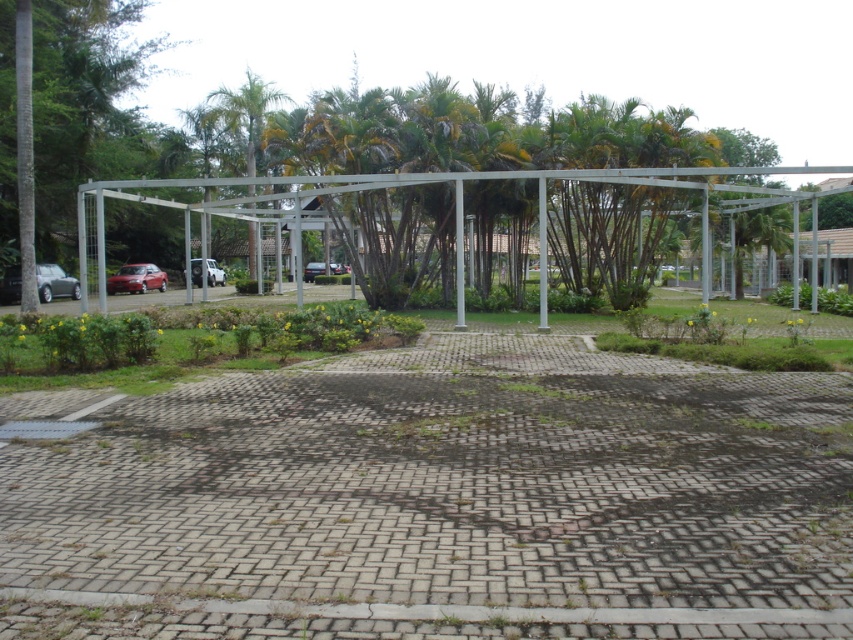
You are standing at the base of the metal pergola structure in the scene. There are two points marked on the structure, point (55,268) and point (192,276). Which point is closer to your current position?

Point (55,268) is closer to the camera than point (192,276), so the point (55,268) is closer to your current position.

You are standing at the entrance of the scene and want to locate the satin silver car at lower left. Which direction should you look relative to the green leafy tree at center?

The green leafy tree at center is to the right of the satin silver car at lower left, so you should look to the left of the green leafy tree at center to find the satin silver car at lower left.

You are a gardener planning to plant a new tree in the area. Considering the existing green leafy tree at center and the white matte car at center, which object takes up more space in the scene?

The green leafy tree at center is larger in size than the white matte car at center, so it takes up more space in the scene.